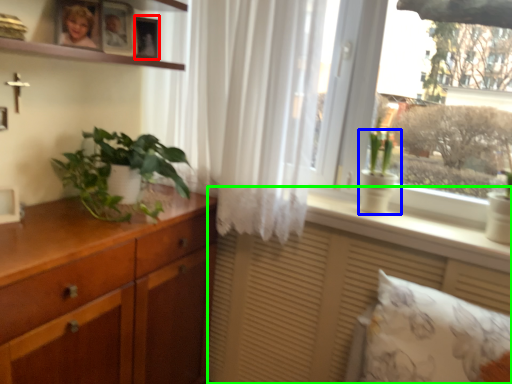
Question: Which object is positioned farthest from picture frame (highlighted by a red box)? Select from houseplant (highlighted by a blue box) and vanity (highlighted by a green box).

Choices:
 (A) houseplant
 (B) vanity

Answer: (B)